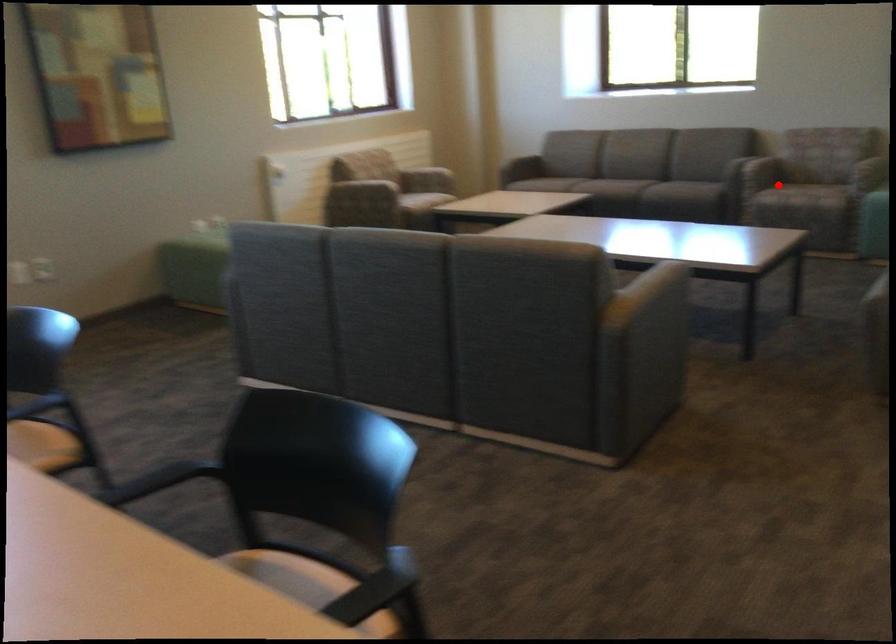
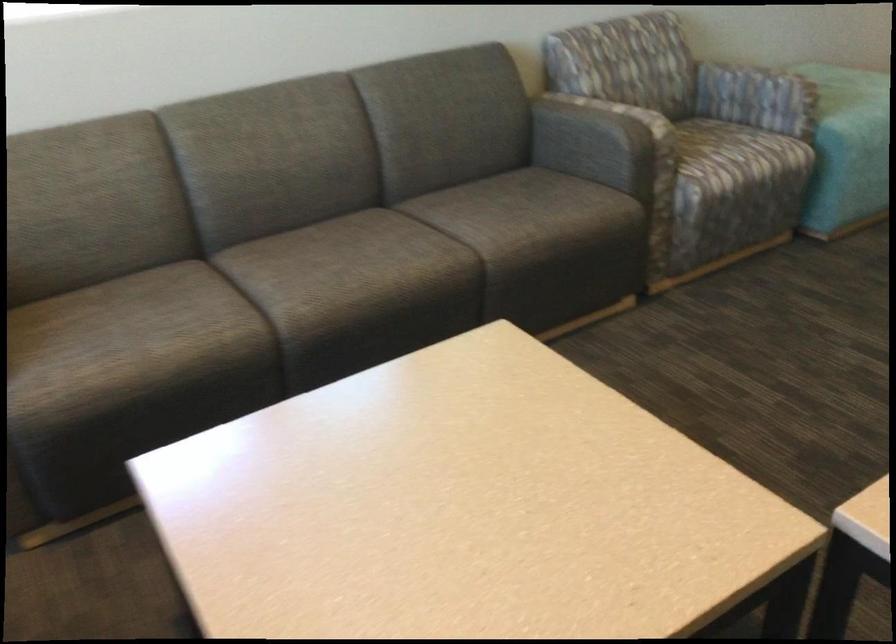
Question: A red point is marked in image1. In image2, is the corresponding 3D point closer to the camera or farther? Reply with the corresponding letter.

Choices:
 (A) The corresponding 3D point is closer.
 (B) The corresponding 3D point is farther.

Answer: (A)